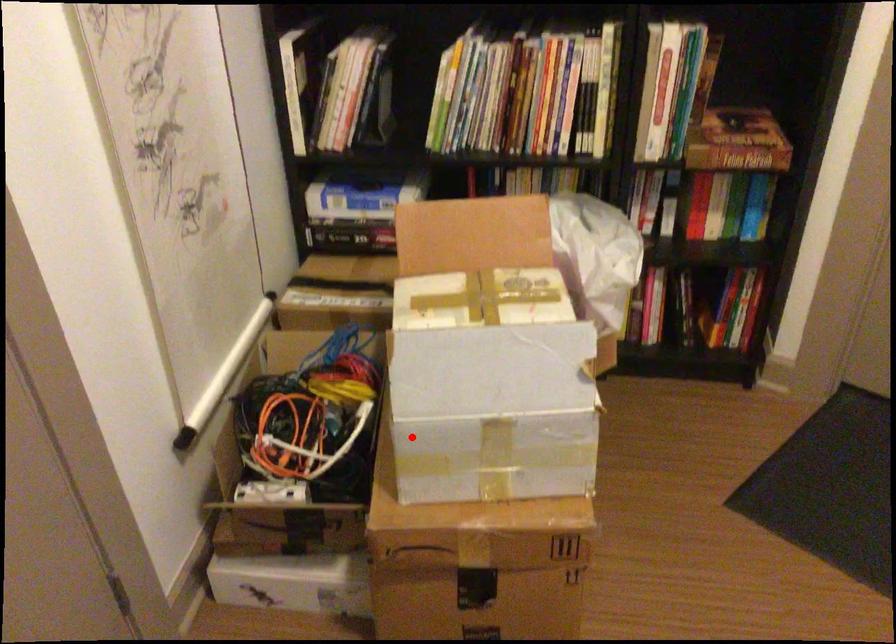
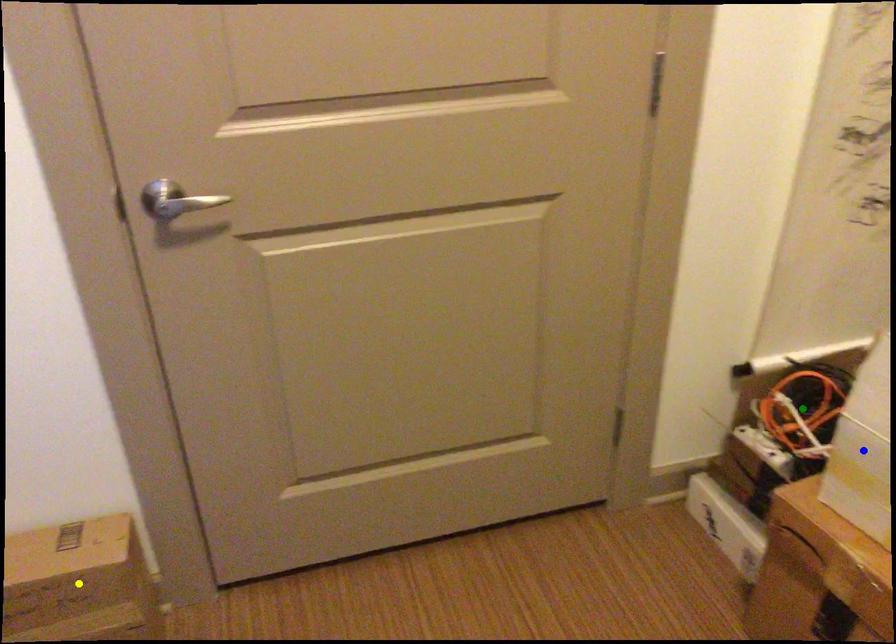
Question: I am providing you with two images of the same scene from different viewpoints. A red point is marked on the first image. You are given multiple points on the second image. Can you choose the point in image 2 that corresponds to the point in image 1?

Choices:
 (A) blue point
 (B) green point
 (C) yellow point

Answer: (A)